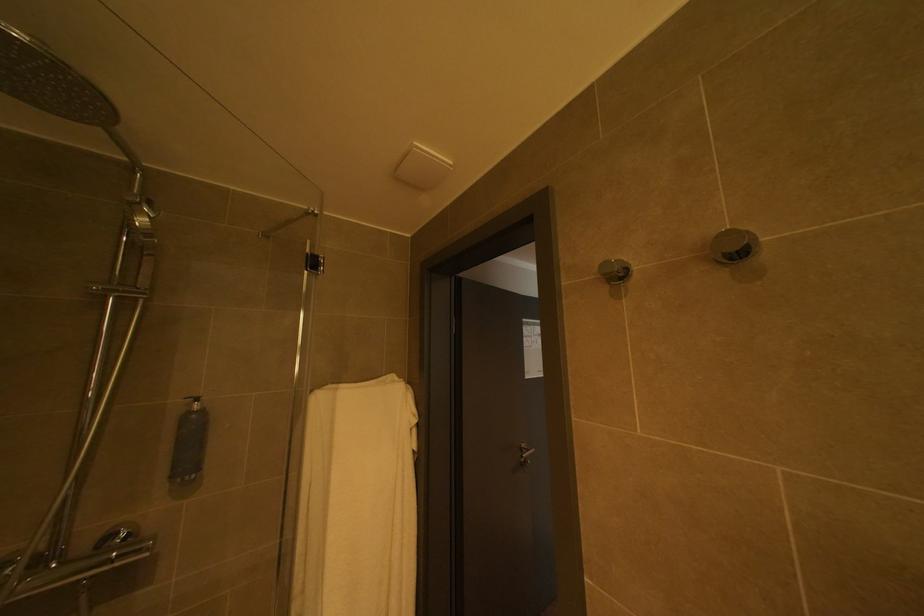
This screenshot has width=924, height=616. What do you see at coordinates (525, 454) in the screenshot? I see `the silver door handle` at bounding box center [525, 454].